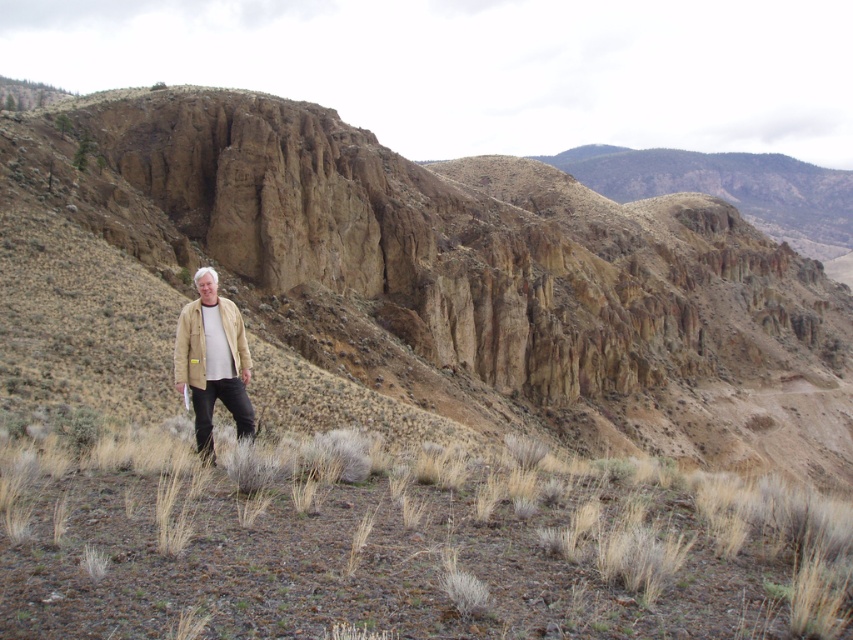
Question: Which point is closer to the camera taking this photo?

Choices:
 (A) pos(241,420)
 (B) pos(595,602)
 (C) pos(236,314)
 (D) pos(769,365)

Answer: (B)

Question: Is brown dirt at center closer to the viewer compared to tan suede trench coat at center?

Choices:
 (A) yes
 (B) no

Answer: (A)

Question: Which object is the closest to the brown dirt at center?

Choices:
 (A) brown rocky mountain at center
 (B) tan suede trench coat at center

Answer: (B)

Question: Is brown rocky mountain at center thinner than brown dirt at center?

Choices:
 (A) yes
 (B) no

Answer: (B)

Question: Considering the relative positions of brown rocky mountain at center and beige fabric jacket at lower left in the image provided, where is brown rocky mountain at center located with respect to beige fabric jacket at lower left?

Choices:
 (A) below
 (B) above

Answer: (B)

Question: Which of the following is the closest to the observer?

Choices:
 (A) (585, 614)
 (B) (672, 296)
 (C) (196, 301)

Answer: (A)